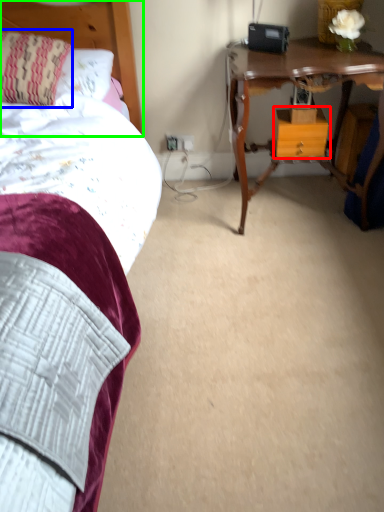
Question: Which object is the closest to the nightstand (highlighted by a red box)? Choose among these: pillow (highlighted by a blue box) or headboard (highlighted by a green box).

Choices:
 (A) pillow
 (B) headboard

Answer: (B)